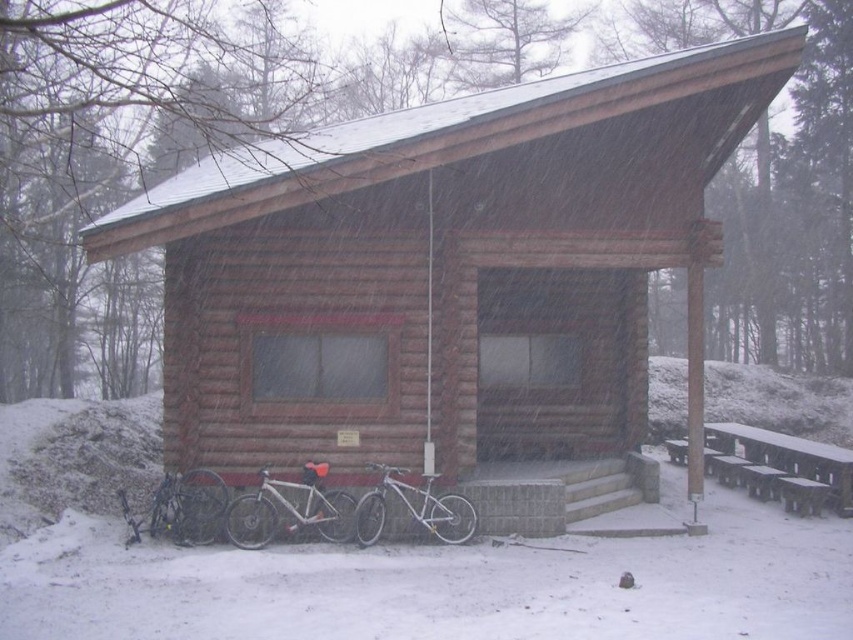
You are standing at the edge of the snowy field near the brown wooden cabin at center. You want to walk to the silver metallic bicycle at lower center. Which direction should you move relative to the cabin?

The brown wooden cabin at center is in front of the silver metallic bicycle at lower center, so you should move away from the cabin towards the direction where the cabin is not blocking your view to reach the bicycle.